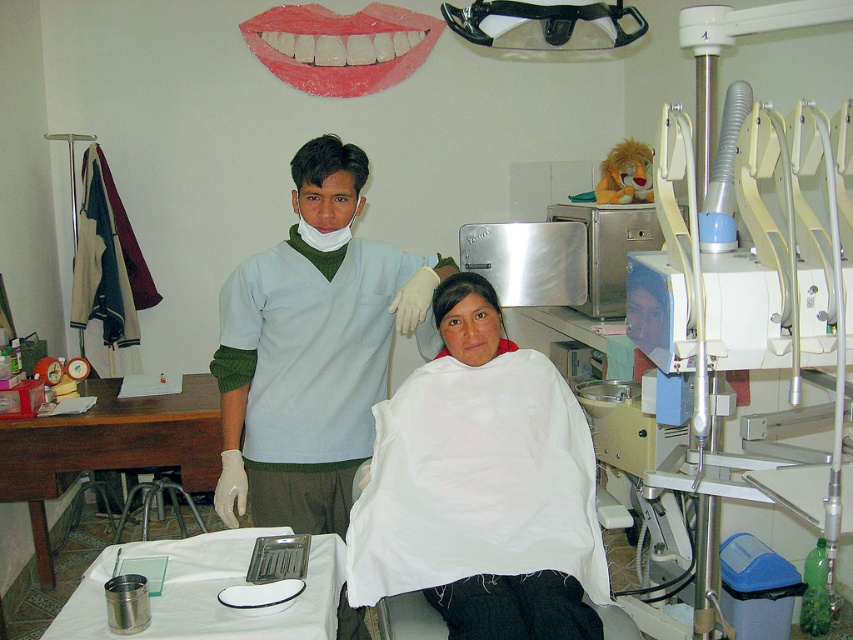
Does white cloth at center have a lesser width compared to shiny plastic mouth at upper center?

Yes.

Is white cloth at center shorter than shiny plastic mouth at upper center?

Incorrect, white cloth at center's height does not fall short of shiny plastic mouth at upper center's.

Is point (526, 406) more distant than point (370, 80)?

No.

The image size is (853, 640). I want to click on white cloth at center, so click(x=491, y=483).

Which is more to the left, light blue scrubs at center or dark brown hair at center?

Positioned to the left is dark brown hair at center.

Is point (352, 321) positioned behind point (326, 140)?

Yes, it is behind point (326, 140).

Who is more distant from viewer, (277, 314) or (346, 160)?

Positioned behind is point (277, 314).

Find the location of a particular element. light blue scrubs at center is located at coordinates [x=312, y=348].

Between brushed metal tray at lower left and shiny plastic mouth at upper center, which one is positioned higher?

Positioned higher is shiny plastic mouth at upper center.

Locate an element on the screen. The image size is (853, 640). brushed metal tray at lower left is located at coordinates (210, 592).